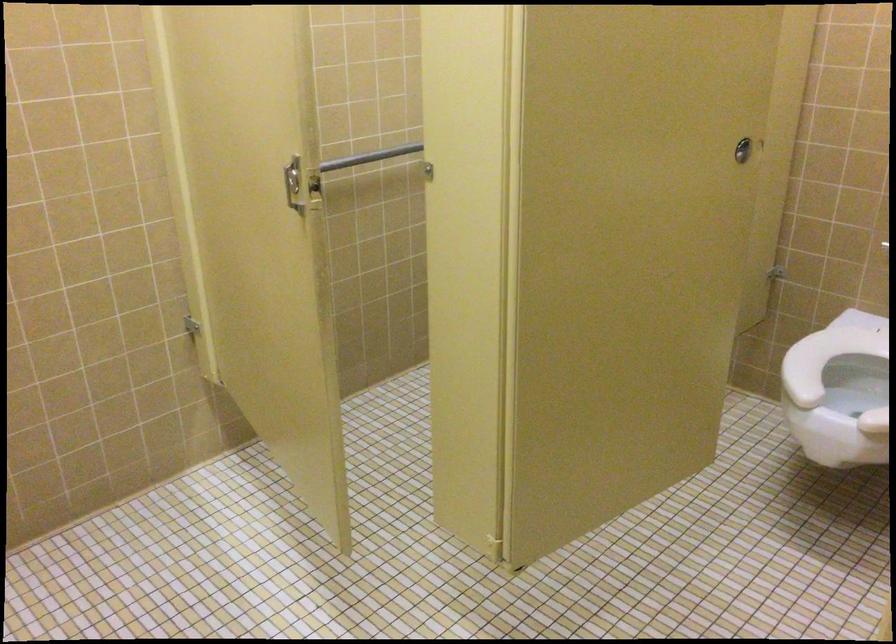
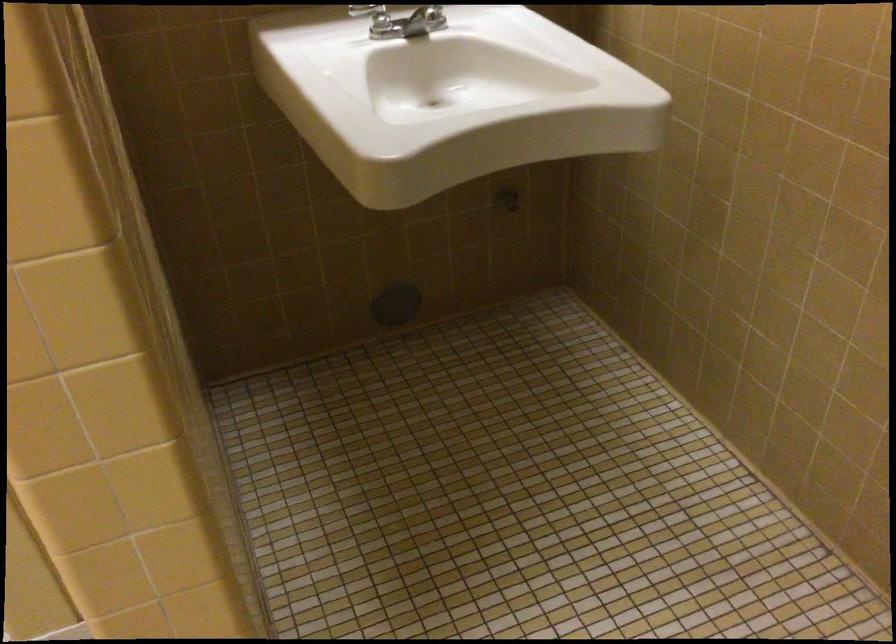
The images are taken continuously from a first-person perspective. In which direction is your viewpoint rotating?

The rotation direction of the camera is right-down.